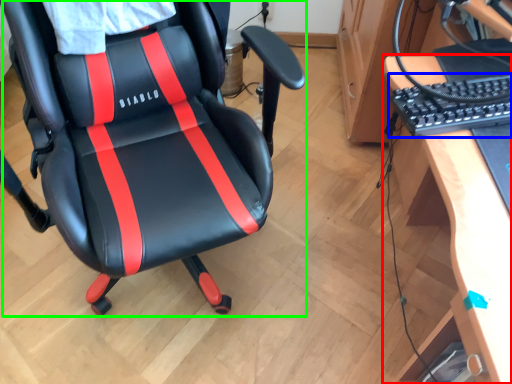
Question: Considering the real-world distances, which object is farthest from desk (highlighted by a red box)? computer keyboard (highlighted by a blue box) or chair (highlighted by a green box)?

Choices:
 (A) computer keyboard
 (B) chair

Answer: (B)